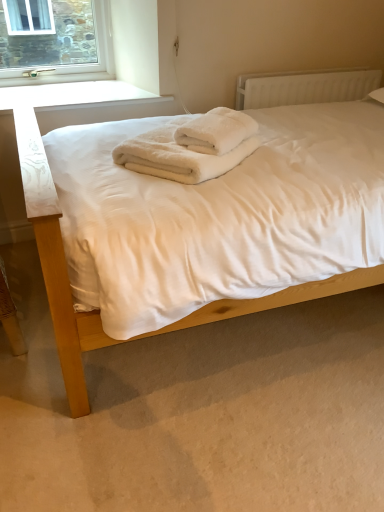
Question: Is white fluffy towels at center to the left or to the right of white plastic radiator at upper right in the image?

Choices:
 (A) left
 (B) right

Answer: (A)

Question: Choose the correct answer: Is white fluffy towels at center inside white plastic radiator at upper right or outside it?

Choices:
 (A) outside
 (B) inside

Answer: (A)

Question: Which of these objects is positioned closest to the white fluffy towels at center?

Choices:
 (A) white plastic radiator at upper right
 (B) white soft bed at center
 (C) white fluffy towels at center

Answer: (C)

Question: Based on their relative distances, which object is nearer to the white fluffy towels at center?

Choices:
 (A) white soft bed at center
 (B) white fluffy towels at center
 (C) white plastic radiator at upper right

Answer: (B)